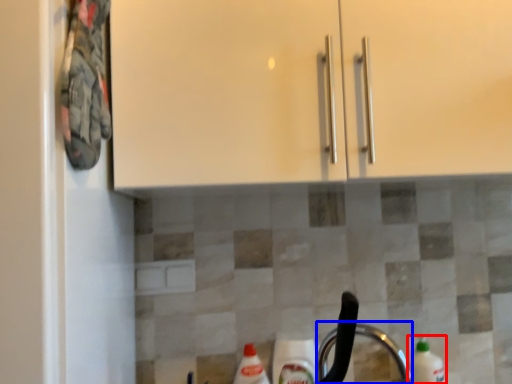
Question: Among these objects, which one is nearest to the camera, cleaning product (highlighted by a red box) or faucet (highlighted by a blue box)?

Choices:
 (A) cleaning product
 (B) faucet

Answer: (B)